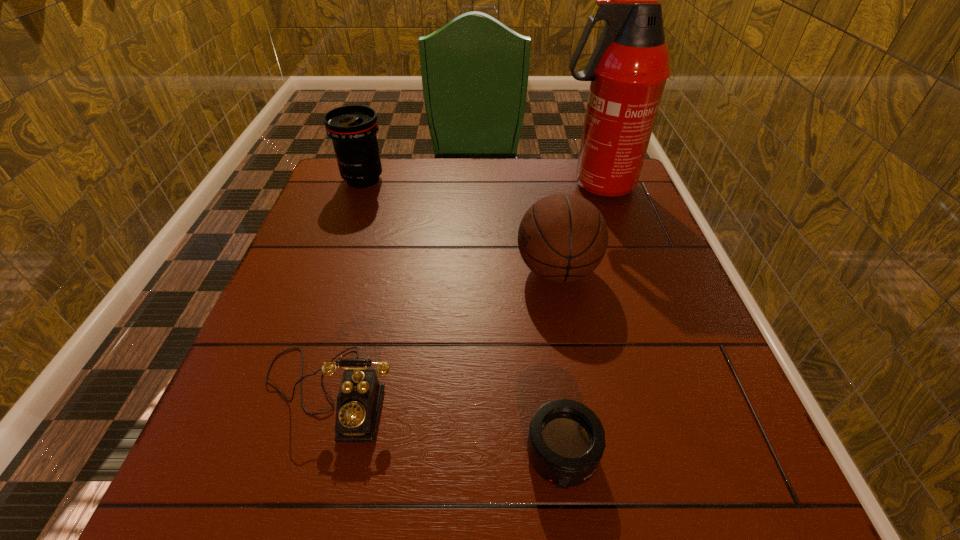
You are a GUI agent. You are given a task and a screenshot of the screen. Output one action in this format:
    pyautogui.click(x=<x>, y=<y>)
    Task: Click on the tallest object
    The image size is (960, 540).
    Given the screenshot: What is the action you would take?
    pyautogui.click(x=628, y=69)

Find the location of `the taller telephoto lens`. the taller telephoto lens is located at coordinates (352, 128).

Locate an element on the screen. the left telephoto lens is located at coordinates (352, 128).

Identify the location of the third nearest object. (562, 237).

This screenshot has height=540, width=960. Identify the location of telephone. (360, 395).

You are a GUI agent. You are given a task and a screenshot of the screen. Output one action in this format:
    pyautogui.click(x=<x>, y=<y>)
    Task: Click on the nearer telephoto lens
    The width and height of the screenshot is (960, 540).
    Given the screenshot: What is the action you would take?
    pyautogui.click(x=566, y=440)

The height and width of the screenshot is (540, 960). I want to click on the shorter telephoto lens, so click(x=566, y=440).

Find the location of a particular element. vacant space situated 0.160m on the trigger side of the tallest object is located at coordinates (498, 185).

This screenshot has width=960, height=540. Identify the location of vacant area situated 0.260m on the trigger side of the tallest object. (463, 185).

Locate an element on the screen. vacant point located on the trigger side of the tallest object is located at coordinates (488, 185).